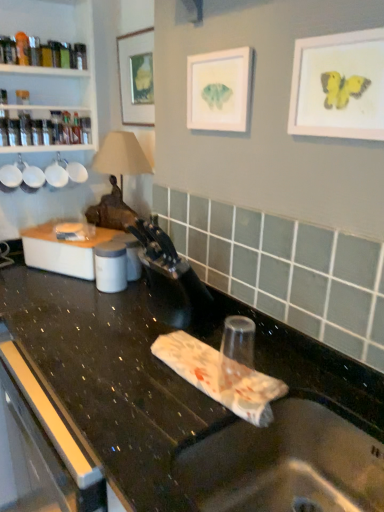
Question: Is metallic stainless steel sink at lower center positioned in front of white plastic container at left?

Choices:
 (A) yes
 (B) no

Answer: (A)

Question: Is metallic stainless steel sink at lower center not near white plastic container at left?

Choices:
 (A) no
 (B) yes

Answer: (A)

Question: Does metallic stainless steel sink at lower center appear on the right side of white plastic container at left?

Choices:
 (A) yes
 (B) no

Answer: (A)

Question: Is metallic stainless steel sink at lower center smaller than white plastic container at left?

Choices:
 (A) yes
 (B) no

Answer: (B)

Question: Considering the relative sizes of metallic stainless steel sink at lower center and white plastic container at left in the image provided, is metallic stainless steel sink at lower center taller than white plastic container at left?

Choices:
 (A) yes
 (B) no

Answer: (B)

Question: Based on their sizes in the image, would you say metallic stainless steel sink at lower center is bigger or smaller than matte yellow butterfly at upper right, which is the first picture frame from right to left?

Choices:
 (A) big
 (B) small

Answer: (A)

Question: In terms of width, does metallic stainless steel sink at lower center look wider or thinner when compared to matte yellow butterfly at upper right, positioned as the 3th picture frame in back-to-front order?

Choices:
 (A) wide
 (B) thin

Answer: (A)

Question: Considering the positions of metallic stainless steel sink at lower center and matte yellow butterfly at upper right, positioned as the 3th picture frame in back-to-front order, in the image, is metallic stainless steel sink at lower center taller or shorter than matte yellow butterfly at upper right, positioned as the 3th picture frame in back-to-front order,?

Choices:
 (A) short
 (B) tall

Answer: (A)

Question: From the image's perspective, is metallic stainless steel sink at lower center located above or below matte yellow butterfly at upper right, acting as the third picture frame starting from the left?

Choices:
 (A) below
 (B) above

Answer: (A)

Question: Is white plastic container at left inside the boundaries of matte yellow butterfly at upper right, which is the 1th picture frame from front to back, or outside?

Choices:
 (A) inside
 (B) outside

Answer: (B)

Question: From a real-world perspective, is white plastic container at left above or below matte yellow butterfly at upper right, which is the 1th picture frame from front to back?

Choices:
 (A) below
 (B) above

Answer: (A)

Question: In terms of size, does white plastic container at left appear bigger or smaller than matte yellow butterfly at upper right, positioned as the 3th picture frame in back-to-front order?

Choices:
 (A) big
 (B) small

Answer: (A)

Question: Relative to matte yellow butterfly at upper right, positioned as the 3th picture frame in back-to-front order, is white plastic container at left in front or behind?

Choices:
 (A) behind
 (B) front

Answer: (A)

Question: Does point (238, 126) appear closer or farther from the camera than point (218, 295)?

Choices:
 (A) closer
 (B) farther

Answer: (A)

Question: From the image's perspective, is matte paper picture frame at center, arranged as the second picture frame when viewed from the left, positioned above or below black granite countertop at center?

Choices:
 (A) above
 (B) below

Answer: (A)